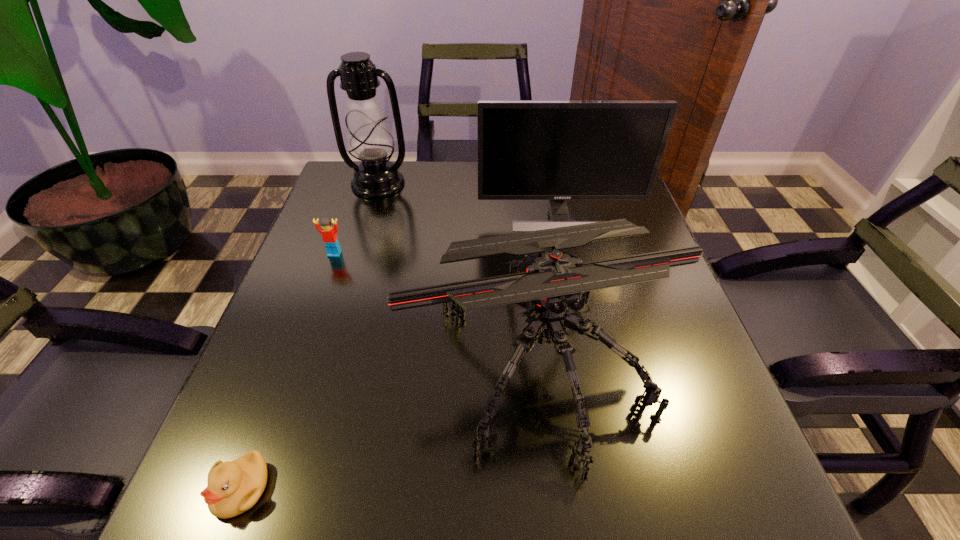
This screenshot has width=960, height=540. I want to click on oil lamp, so click(x=369, y=139).

The image size is (960, 540). I want to click on monitor, so click(x=556, y=150).

Identify the location of drone. The width and height of the screenshot is (960, 540). (548, 282).

The height and width of the screenshot is (540, 960). I want to click on the third nearest object, so click(329, 234).

I want to click on Lego, so click(329, 234).

Where is `the shortest object`? The width and height of the screenshot is (960, 540). the shortest object is located at coordinates (233, 487).

Identify the location of free space located 0.150m on the right of the oil lamp. (463, 184).

Locate an element on the screen. vacant space located on the screen side of the second farthest object is located at coordinates 584,329.

You are a GUI agent. You are given a task and a screenshot of the screen. Output one action in this format:
    pyautogui.click(x=<x>, y=<y>)
    Task: Click on the vacant space located on the left of the drone
    
    Given the screenshot: What is the action you would take?
    pyautogui.click(x=343, y=361)

Find the location of `vacant region located 0.110m on the face of the third farthest object`. vacant region located 0.110m on the face of the third farthest object is located at coordinates [321, 291].